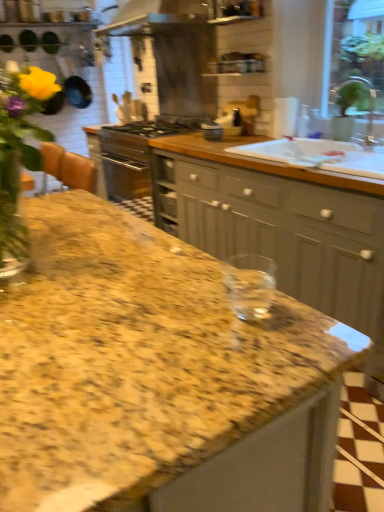
This screenshot has height=512, width=384. I want to click on free spot to the left of matte black kettle at center, arranged as the 1th appliance when viewed from the front, so click(196, 136).